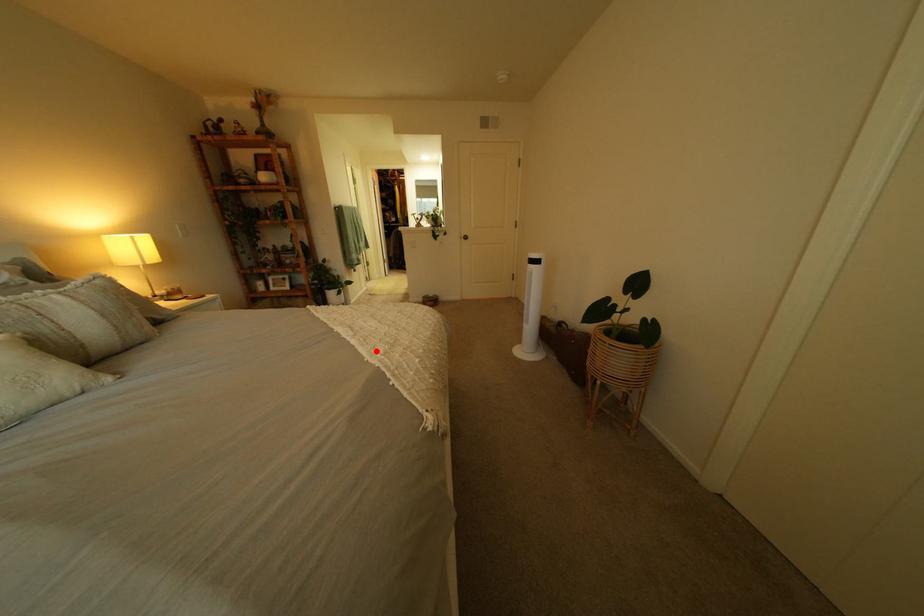
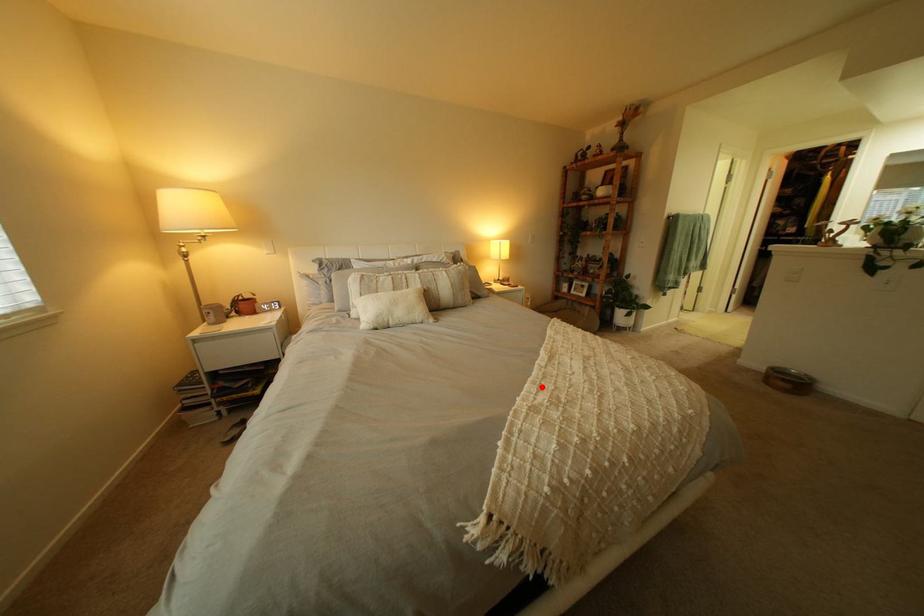
I am providing you with two images of the same scene from different viewpoints. A red point is marked on the first image and another point is marked on the second image. Is the marked point in image1 the same physical position as the marked point in image2?

Yes